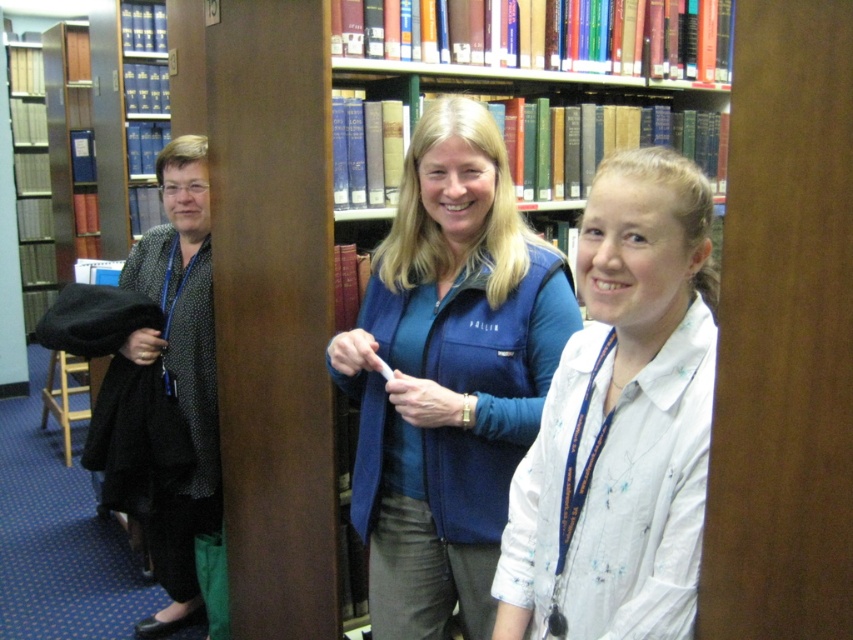
Question: Can you confirm if blue fleece vest at center is wider than wooden bookcase at center?

Choices:
 (A) no
 (B) yes

Answer: (A)

Question: Which of these objects is positioned farthest from the white cotton shirt at center?

Choices:
 (A) blue fleece vest at center
 (B) wooden bookcase at center

Answer: (A)

Question: Which is farther from the wooden bookcase at center?

Choices:
 (A) blue fleece vest at center
 (B) white cotton shirt at center

Answer: (A)

Question: Which object is the closest to the white cotton shirt at center?

Choices:
 (A) blue fleece vest at center
 (B) black dotted blouse at left
 (C) wooden bookcase at center

Answer: (C)

Question: Considering the relative positions of blue fleece vest at center and wooden bookcase at center in the image provided, where is blue fleece vest at center located with respect to wooden bookcase at center?

Choices:
 (A) right
 (B) left

Answer: (B)

Question: Is wooden bookcase at center closer to camera compared to black dotted blouse at left?

Choices:
 (A) yes
 (B) no

Answer: (A)